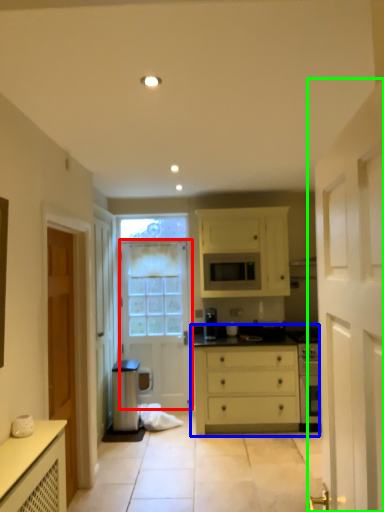
Question: Based on their relative distances, which object is farther from door (highlighted by a red box)? Choose from chest of drawers (highlighted by a blue box) and door (highlighted by a green box).

Choices:
 (A) chest of drawers
 (B) door

Answer: (B)